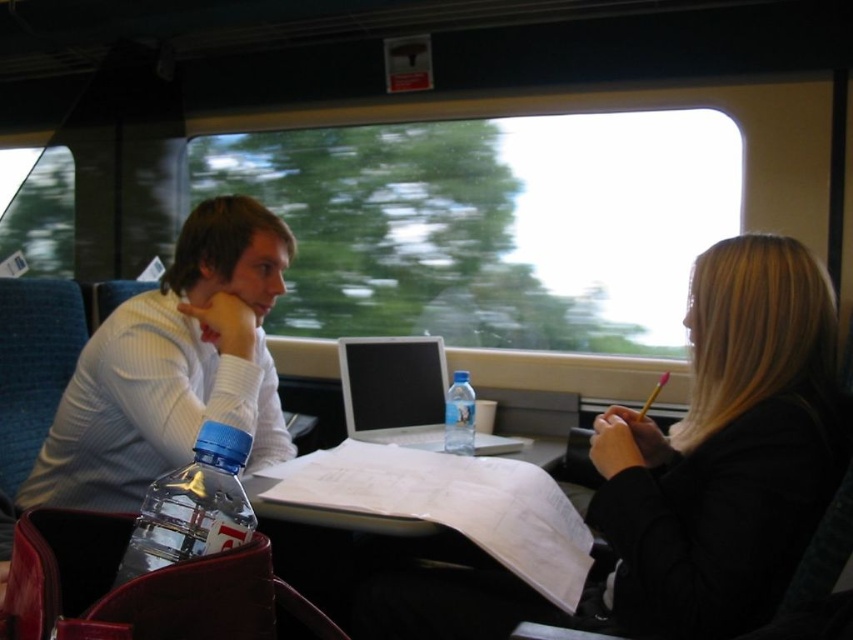
Question: Considering the relative positions of black matte jacket at right and white textured shirt at center in the image provided, where is black matte jacket at right located with respect to white textured shirt at center?

Choices:
 (A) above
 (B) below

Answer: (A)

Question: Can you confirm if black matte jacket at right is positioned to the right of transparent plastic bottle at lower left?

Choices:
 (A) no
 (B) yes

Answer: (B)

Question: Which object appears farthest from the camera in this image?

Choices:
 (A) black matte jacket at right
 (B) white paper at center
 (C) clear plastic bottle at center

Answer: (C)

Question: Among these objects, which one is nearest to the camera?

Choices:
 (A) black matte jacket at right
 (B) silver metallic laptop at center

Answer: (A)

Question: Which point is farther to the camera?

Choices:
 (A) silver metallic laptop at center
 (B) clear plastic bottle at center
 (C) black matte jacket at right

Answer: (A)

Question: Does black matte jacket at right appear over clear plastic bottle at center?

Choices:
 (A) no
 (B) yes

Answer: (B)